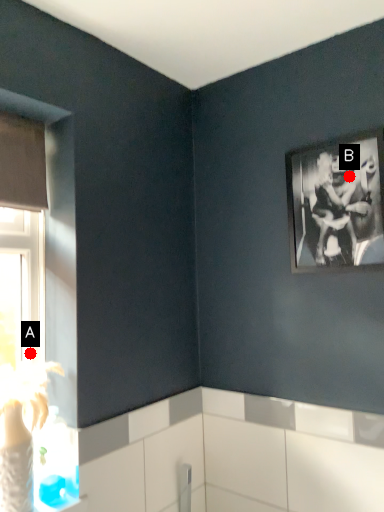
Question: Two points are circled on the image, labeled by A and B beside each circle. Which point is closer to the camera taking this photo?

Choices:
 (A) A is closer
 (B) B is closer

Answer: (B)